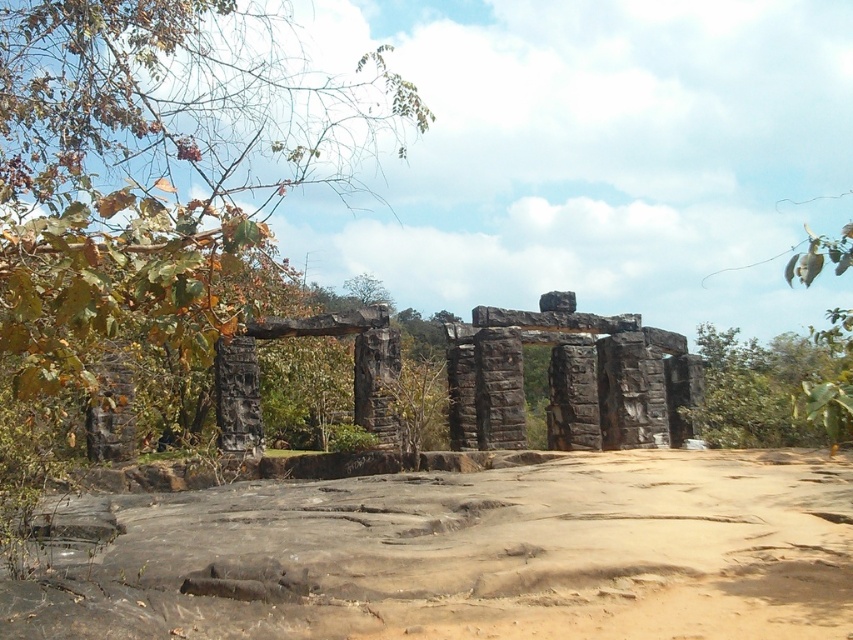
You are standing at point (158, 164) in the ancient stone structure. What can you see immediately around you?

At point (158, 164), there is a green leafy tree at left nearby.

You are an archaeologist examining the ancient stone structure. You notice the brown sandy dirt field at center and the green leafy tree at center. Which object is located to the left of the other?

The brown sandy dirt field at center is positioned on the left side of green leafy tree at center.